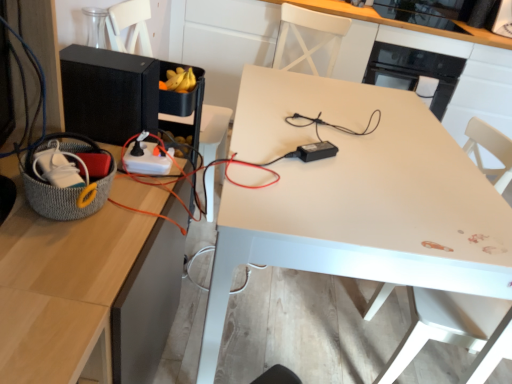
At what (x,y) coordinates should I click in order to perform the action: click on vacant area that lies to the right of black plastic power adapter at center, positioned as the second appliance in left-to-right order. Please return your answer as a coordinate pair (x, y). Looking at the image, I should click on [382, 174].